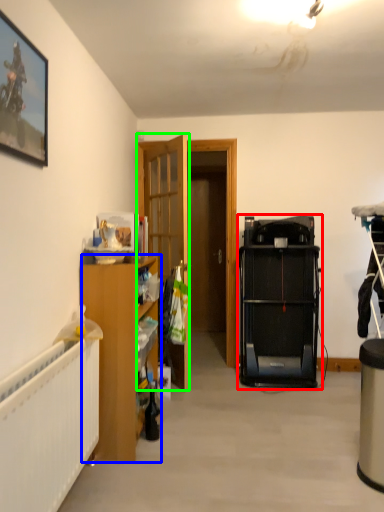
Question: Which object is positioned farthest from equipment (highlighted by a red box)? Select from cabinetry (highlighted by a blue box) and door (highlighted by a green box).

Choices:
 (A) cabinetry
 (B) door

Answer: (A)